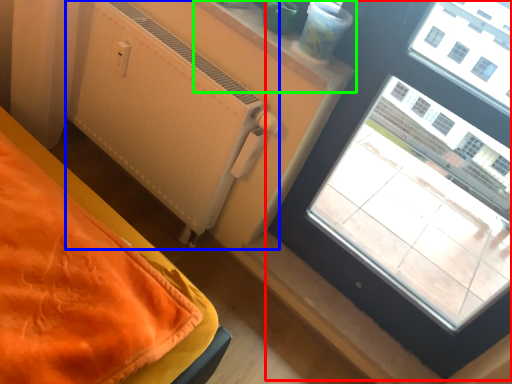
Question: Which object is positioned farthest from window (highlighted by a red box)? Select from radiator (highlighted by a blue box) and window sill (highlighted by a green box).

Choices:
 (A) radiator
 (B) window sill

Answer: (A)